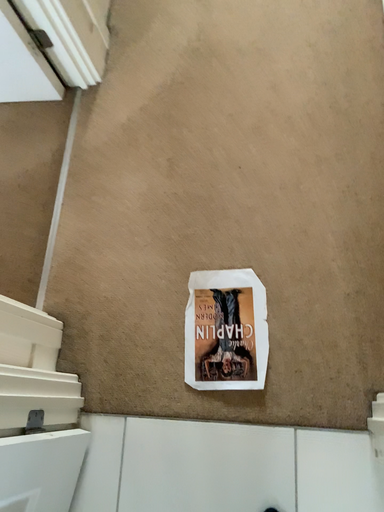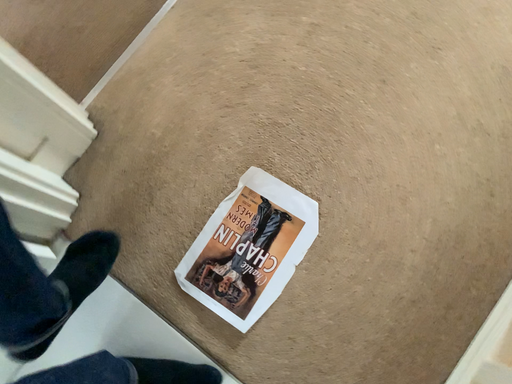
Question: Which way did the camera rotate in the video?

Choices:
 (A) rotated downward
 (B) rotated upward

Answer: (A)